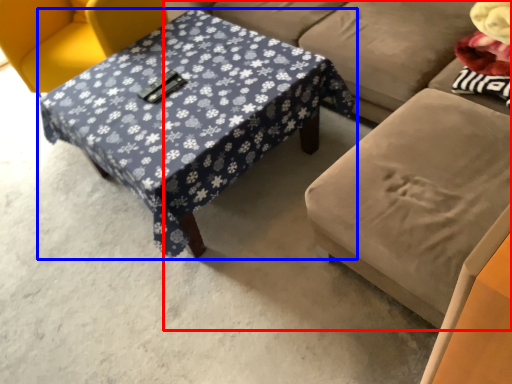
Question: Which of the following is the farthest to the observer, studio couch (highlighted by a red box) or table (highlighted by a blue box)?

Choices:
 (A) studio couch
 (B) table

Answer: (B)